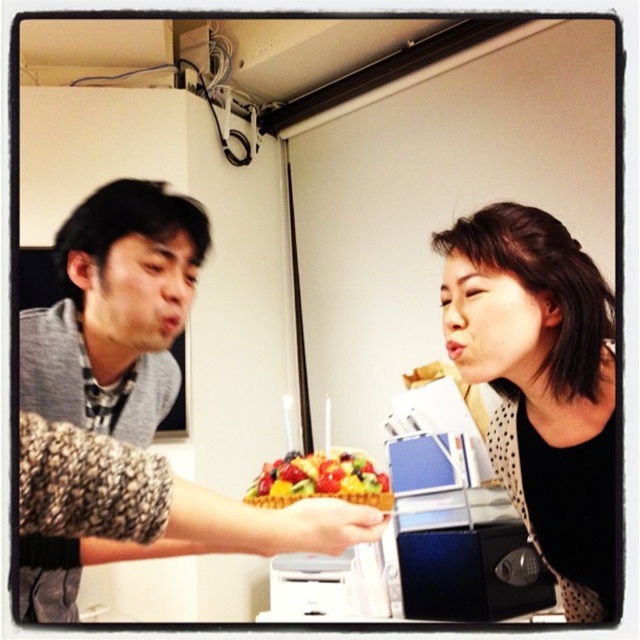
You are organizing a charity event and need to decide which of the two outfits, the black dotted blouse at right or the gray knitted sweater at left, would be more suitable for a larger group photo where visibility is key. Based on their sizes, which one should you choose?

The black dotted blouse at right has a larger width than the gray knitted sweater at left, making it more visible in a group photo. Choose the black dotted blouse at right for better visibility.

Consider the image. You are a fashion designer observing the scene. You need to determine which clothing item is shorter between the black dotted blouse at right and the gray knitted sweater at left. Based on the description, which one is shorter?

The black dotted blouse at right is shorter than the gray knitted sweater at left according to the description.

You are standing in the room and want to place a new poster on the wall. The poster must be placed at the same 2D location as the black dotted blouse at right. Where should you place the poster?

The poster should be placed at the 2D coordinates point (541, 385) on the wall, which is the same location as the black dotted blouse at right.